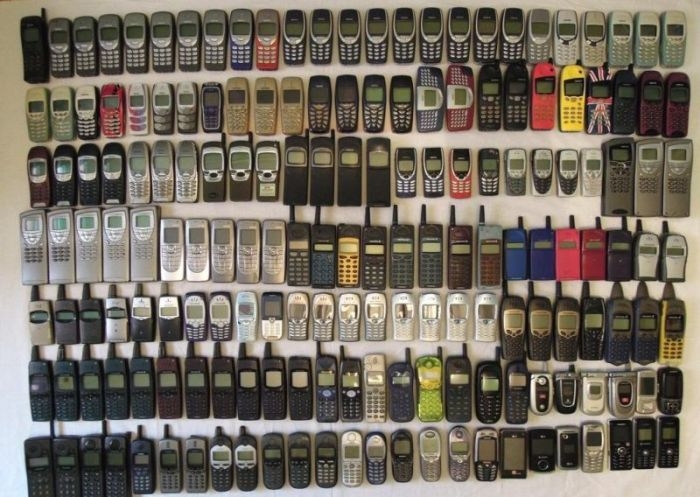
Find the location of a particular element. The image size is (700, 497). led is located at coordinates (673, 325).